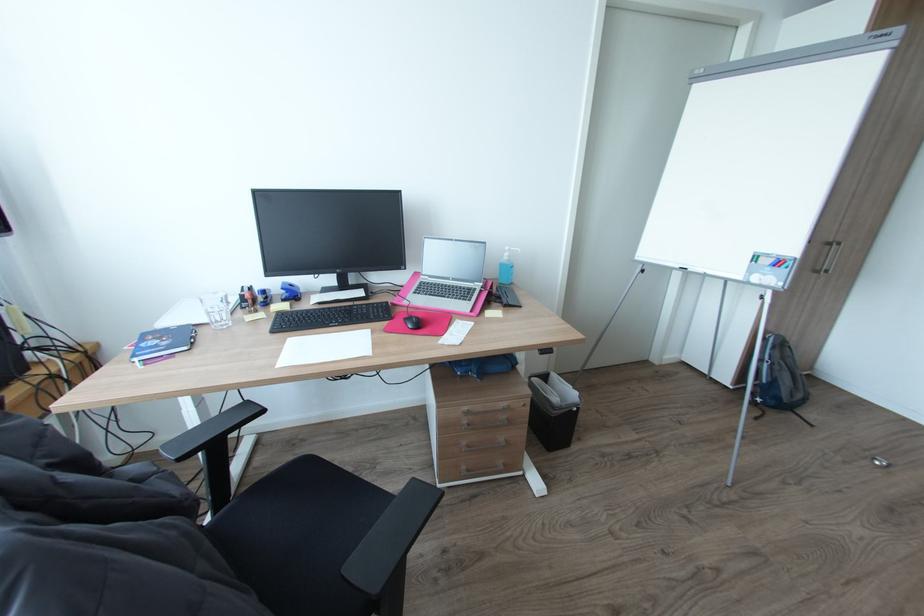
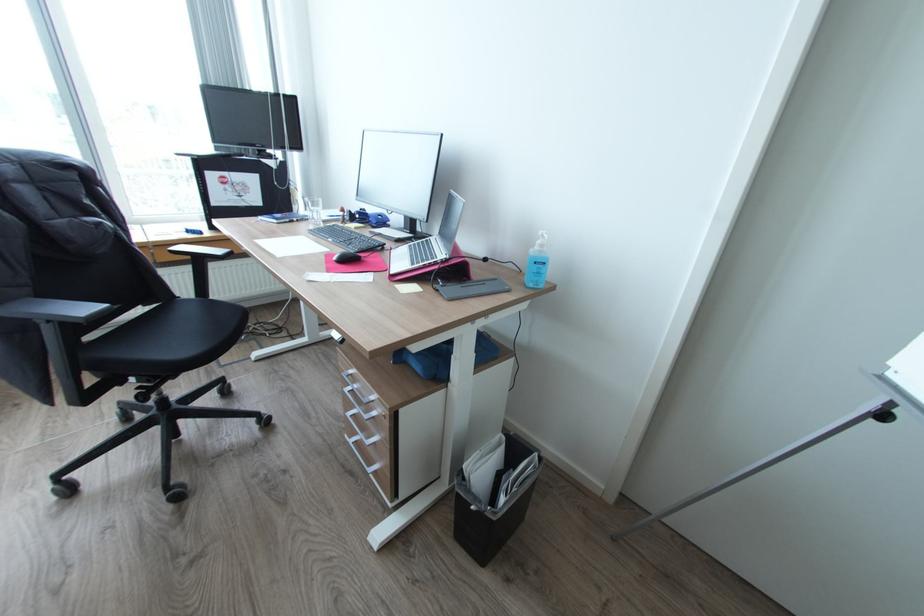
Where in the second image is the point corresponding to (470,408) from the first image?

(357, 371)